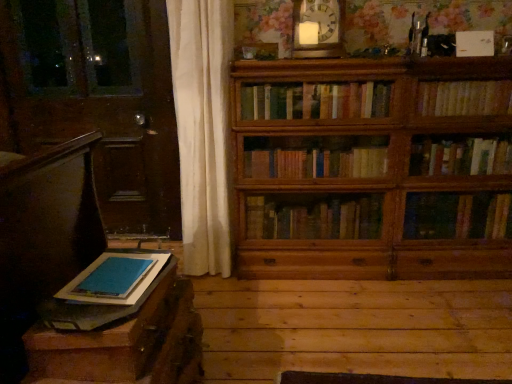
Question: In terms of height, does blue felt book at lower left, the 2th book from the top, look taller or shorter compared to dark brown leather armchair at left?

Choices:
 (A) short
 (B) tall

Answer: (A)

Question: Looking at their shapes, would you say blue felt book at lower left, which is the second book in right-to-left order, is wider or thinner than dark brown leather armchair at left?

Choices:
 (A) wide
 (B) thin

Answer: (B)

Question: Estimate the real-world distances between objects in this image. Which object is farther from the dark brown leather armchair at left?

Choices:
 (A) wooden table at lower left
 (B) wooden clock at upper center
 (C) blue felt book at lower left, the 2th book from the top
 (D) wooden bookshelf at right, which appears as the second book when ordered from the bottom
 (E) wooden bookcase at right

Answer: (D)

Question: Which of these objects is positioned closest to the wooden table at lower left?

Choices:
 (A) wooden bookshelf at right, which appears as the second book when ordered from the bottom
 (B) blue felt book at lower left, the first book ordered from the bottom
 (C) dark brown leather armchair at left
 (D) wooden clock at upper center
 (E) wooden bookcase at right

Answer: (C)